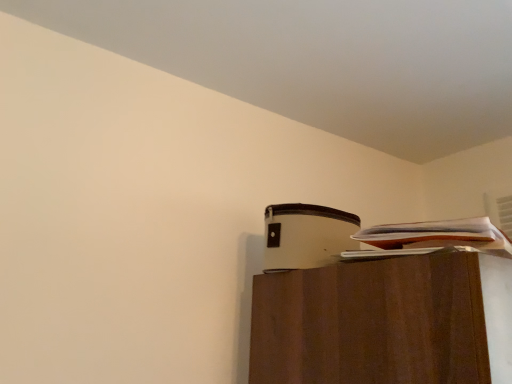
What do you see at coordinates (306, 235) in the screenshot? The image size is (512, 384). I see `matte beige water heater at upper center` at bounding box center [306, 235].

Locate an element on the screen. matte beige water heater at upper center is located at coordinates (306, 235).

Identify the location of matte beige water heater at upper center. This screenshot has height=384, width=512. (306, 235).